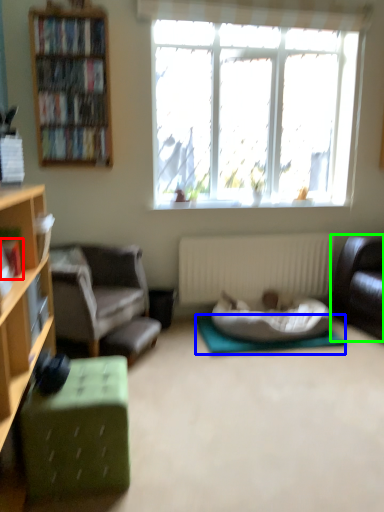
Question: Based on their relative distances, which object is farther from book (highlighted by a red box)? Choose from yoga mat (highlighted by a blue box) and studio couch (highlighted by a green box).

Choices:
 (A) yoga mat
 (B) studio couch

Answer: (B)